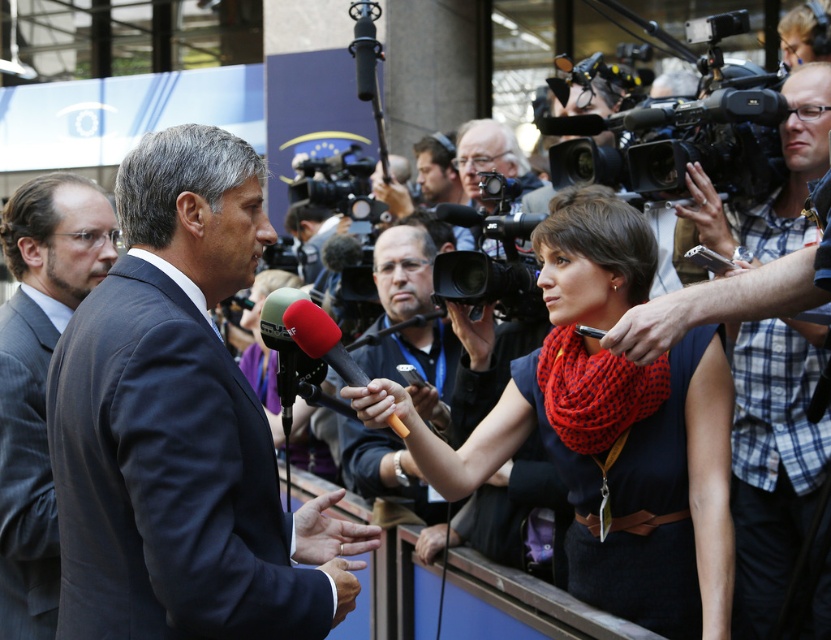
You are a photographer at the event and need to capture a clear shot of the gray wool suit at left and the matte black microphone at center. Which object is narrower when viewed from your position?

The gray wool suit at left is thinner than the matte black microphone at center, so the gray wool suit at left is narrower when viewed from your position.